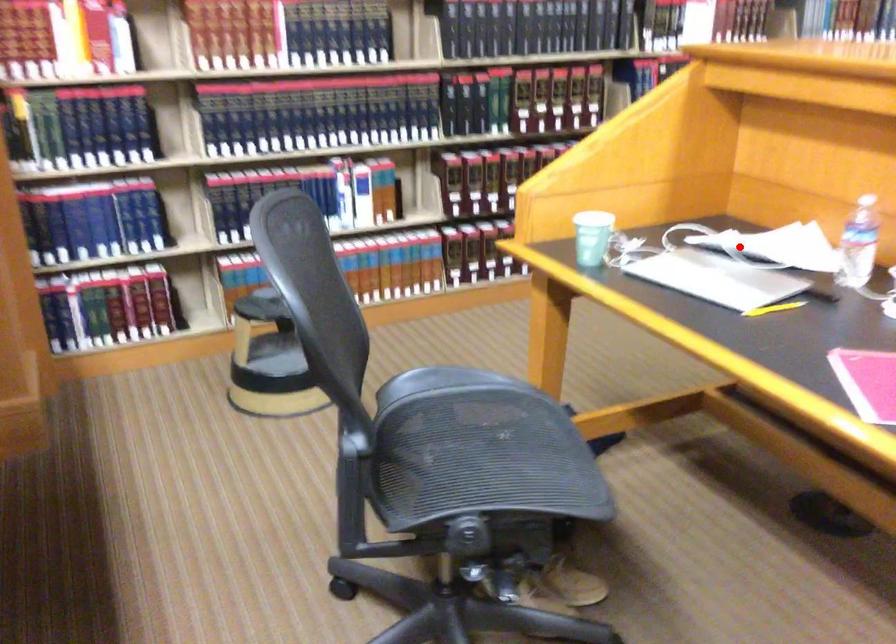
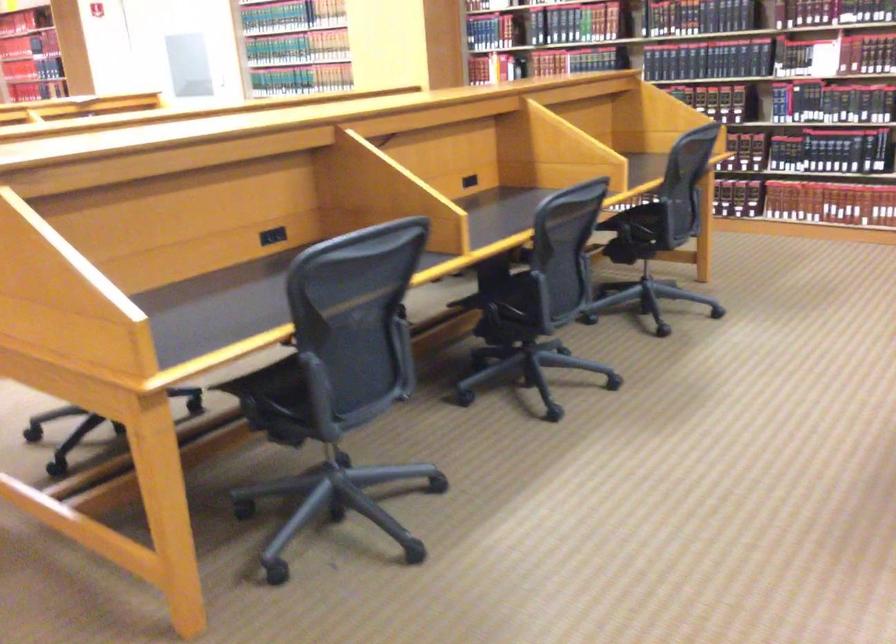
Question: I am providing you with two images of the same scene from different viewpoints. A red point is marked on the first image. Is the red point's position out of view in image 2?

Choices:
 (A) Yes
 (B) No

Answer: (A)